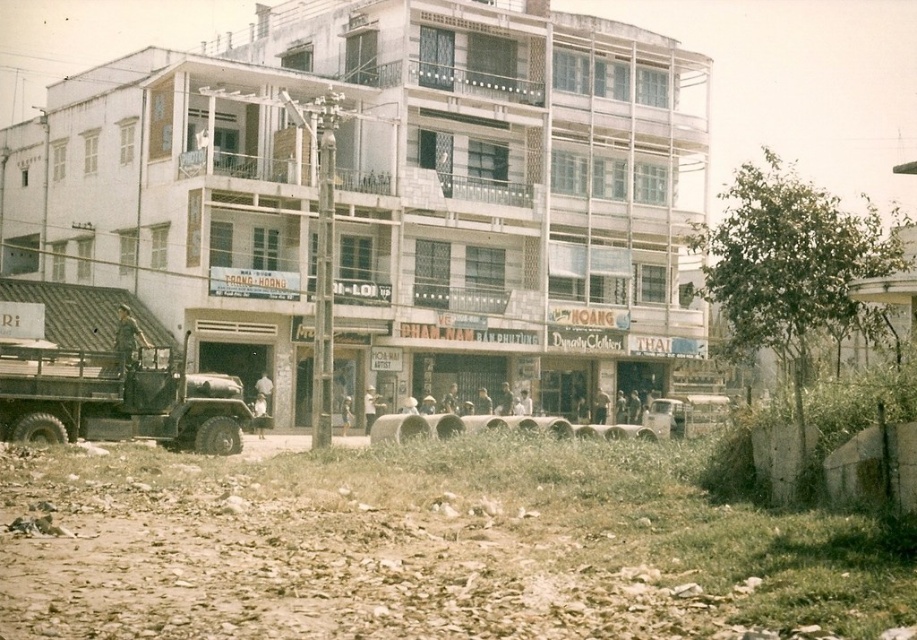
Question: Among these points, which one is nearest to the camera?

Choices:
 (A) (669, 424)
 (B) (43, 400)

Answer: (B)

Question: Can you confirm if matte black truck at left is bigger than metallic silver car at center?

Choices:
 (A) yes
 (B) no

Answer: (A)

Question: Which point is farther to the camera?

Choices:
 (A) metallic silver car at center
 (B) matte black truck at left

Answer: (A)

Question: Among these points, which one is farthest from the camera?

Choices:
 (A) (83, 392)
 (B) (668, 412)

Answer: (B)

Question: Is matte black truck at left wider than metallic silver car at center?

Choices:
 (A) yes
 (B) no

Answer: (A)

Question: Is matte black truck at left to the left of metallic silver car at center from the viewer's perspective?

Choices:
 (A) yes
 (B) no

Answer: (A)